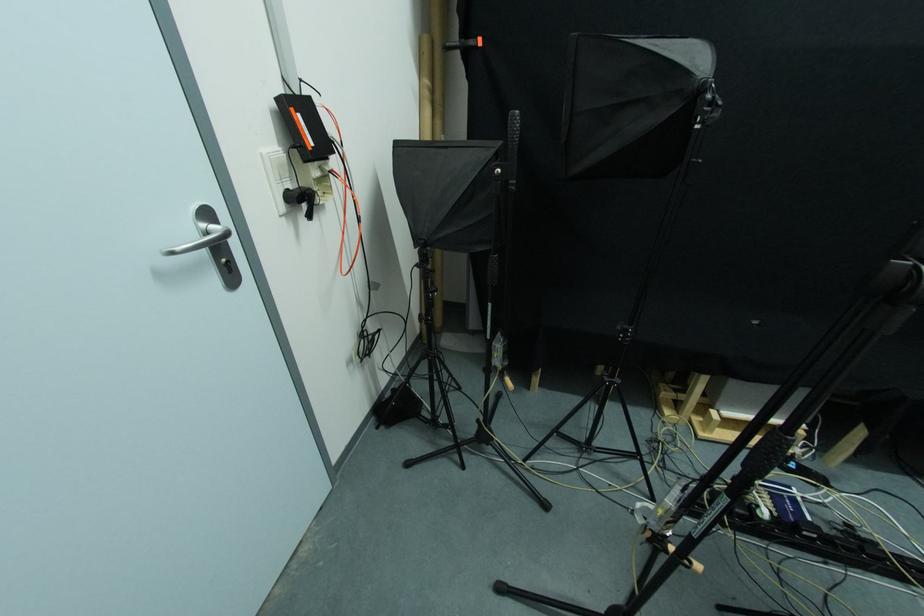
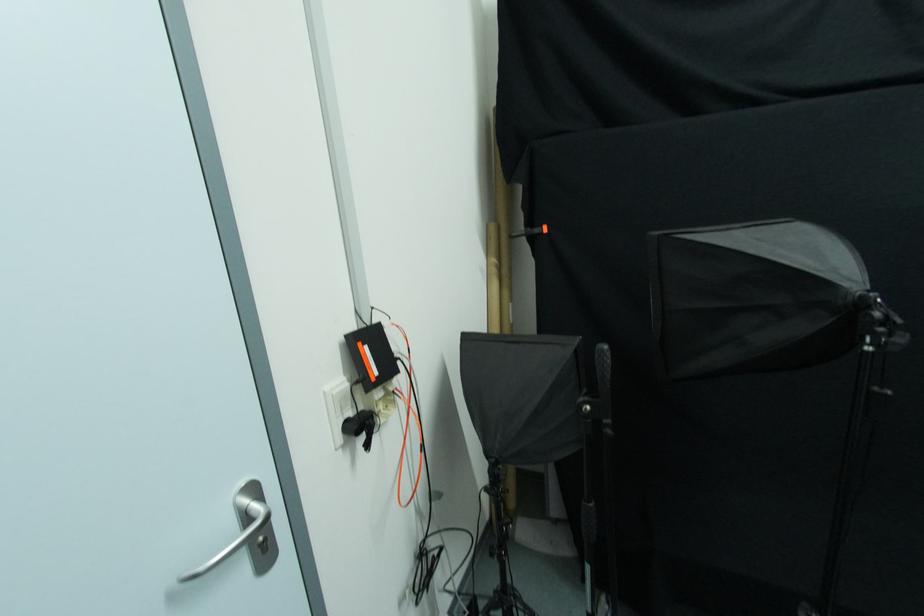
Question: The images are taken continuously from a first-person perspective. In which direction is your viewpoint rotating?

Choices:
 (A) Left
 (B) Right
 (C) Up
 (D) Down

Answer: (C)